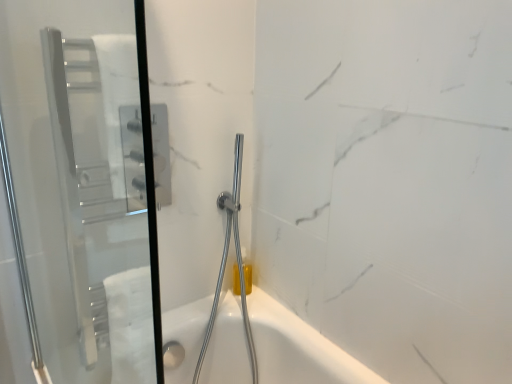
Question: Does chrome metallic shower head at center lie in front of transparent glass screen door at left?

Choices:
 (A) no
 (B) yes

Answer: (A)

Question: Is chrome metallic shower head at center not inside transparent glass screen door at left?

Choices:
 (A) yes
 (B) no

Answer: (A)

Question: From the image's perspective, does chrome metallic shower head at center appear higher than transparent glass screen door at left?

Choices:
 (A) yes
 (B) no

Answer: (B)

Question: Is chrome metallic shower head at center positioned behind transparent glass screen door at left?

Choices:
 (A) no
 (B) yes

Answer: (B)

Question: Is chrome metallic shower head at center turned away from transparent glass screen door at left?

Choices:
 (A) no
 (B) yes

Answer: (A)

Question: Considering the relative sizes of chrome metallic shower head at center and transparent glass screen door at left in the image provided, is chrome metallic shower head at center wider than transparent glass screen door at left?

Choices:
 (A) no
 (B) yes

Answer: (B)

Question: Is transparent glass screen door at left not inside chrome metallic shower head at center?

Choices:
 (A) no
 (B) yes

Answer: (B)

Question: Are transparent glass screen door at left and chrome metallic shower head at center beside each other?

Choices:
 (A) no
 (B) yes

Answer: (A)

Question: Does transparent glass screen door at left appear on the left side of chrome metallic shower head at center?

Choices:
 (A) yes
 (B) no

Answer: (A)

Question: Is transparent glass screen door at left facing away from chrome metallic shower head at center?

Choices:
 (A) no
 (B) yes

Answer: (B)

Question: From the image's perspective, is transparent glass screen door at left above chrome metallic shower head at center?

Choices:
 (A) no
 (B) yes

Answer: (B)

Question: Is transparent glass screen door at left not close to chrome metallic shower head at center?

Choices:
 (A) yes
 (B) no

Answer: (B)

Question: From the image's perspective, is transparent glass screen door at left positioned above or below chrome metallic shower head at center?

Choices:
 (A) above
 (B) below

Answer: (A)